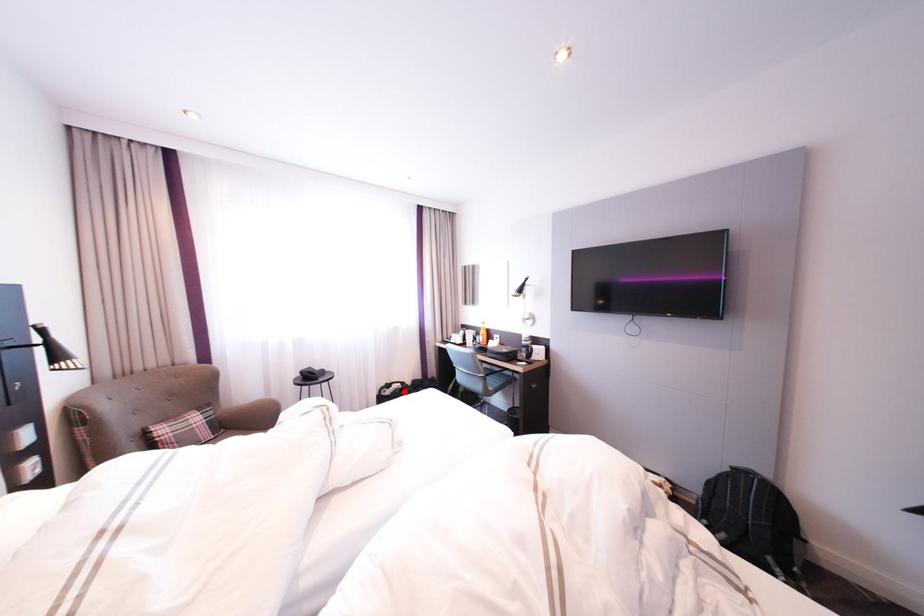
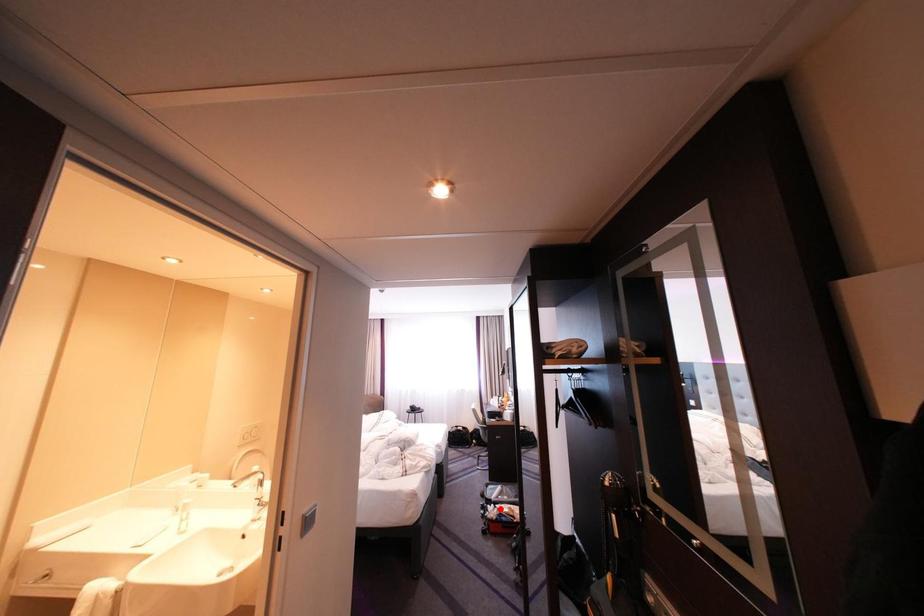
I am providing you with two images of the same scene from different viewpoints. A red point is marked on the first image and another point is marked on the second image. Does the point marked in image1 correspond to the same location as the one in image2?

No